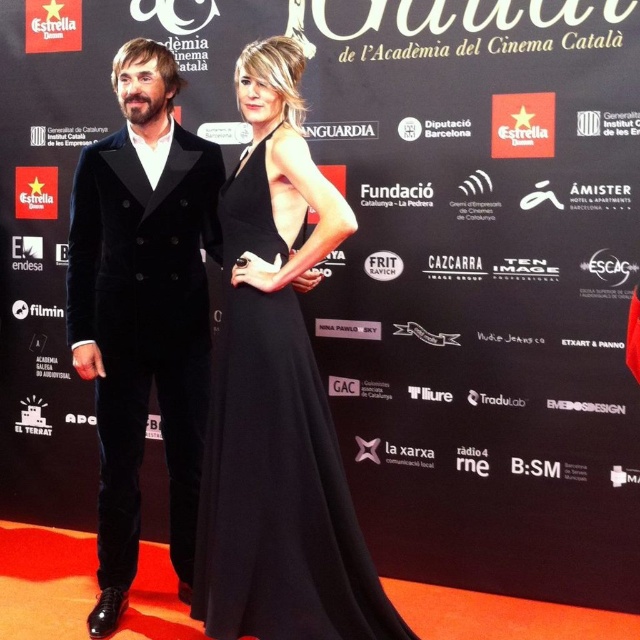
Question: Among these objects, which one is farthest from the camera?

Choices:
 (A) velvet black suit at left
 (B) black satin dress at center

Answer: (A)

Question: Which object is farther from the camera taking this photo?

Choices:
 (A) velvet black suit at left
 (B) black satin dress at center

Answer: (A)

Question: Does velvet black suit at left appear over black satin dress at center?

Choices:
 (A) yes
 (B) no

Answer: (A)

Question: Is velvet black suit at left wider than black satin dress at center?

Choices:
 (A) no
 (B) yes

Answer: (A)

Question: Is velvet black suit at left to the left of black satin dress at center from the viewer's perspective?

Choices:
 (A) no
 (B) yes

Answer: (B)